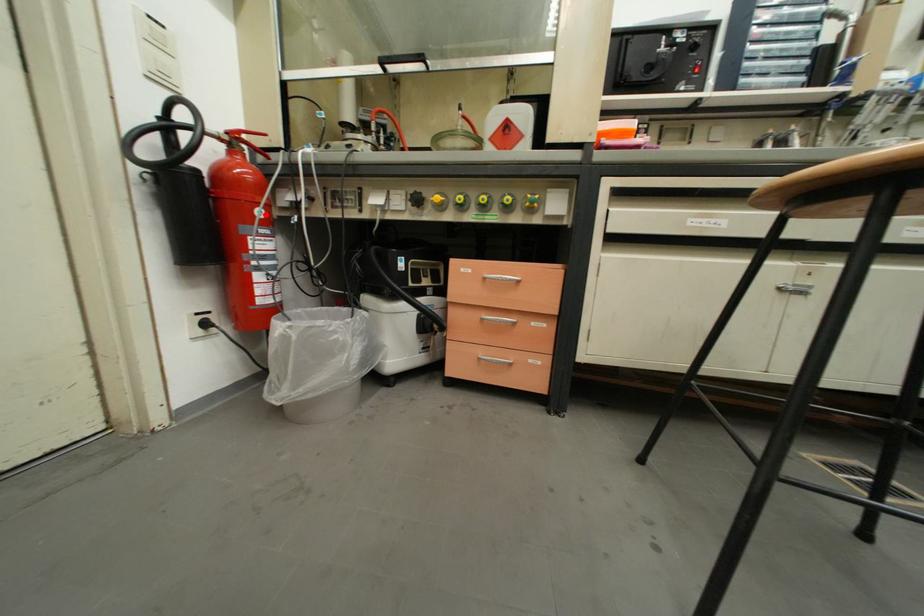
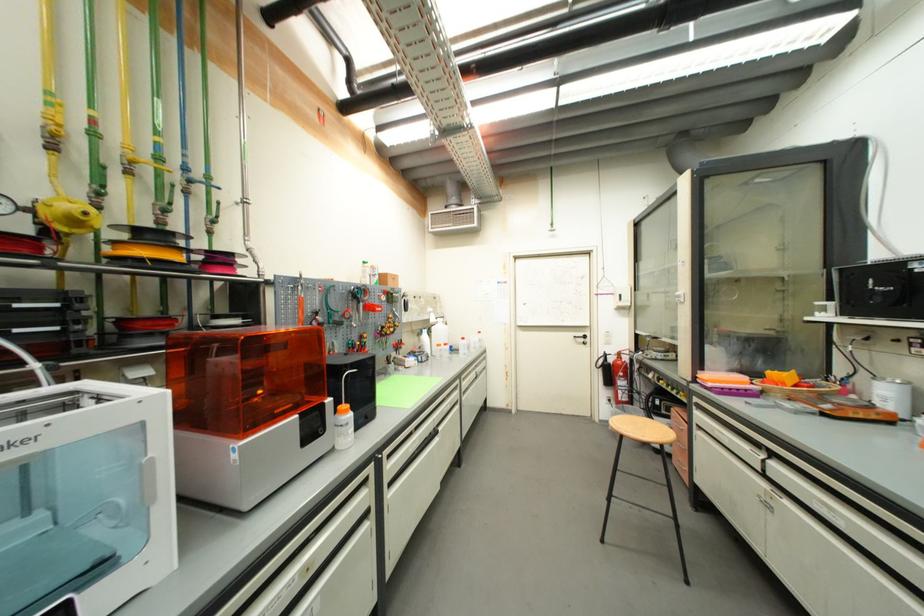
Question: I am providing you with two images of the same scene from different viewpoints. In image1, a red point is highlighted. Considering the same 3D point in image2, which of the following is correct?

Choices:
 (A) It is closer
 (B) It is farther

Answer: (B)